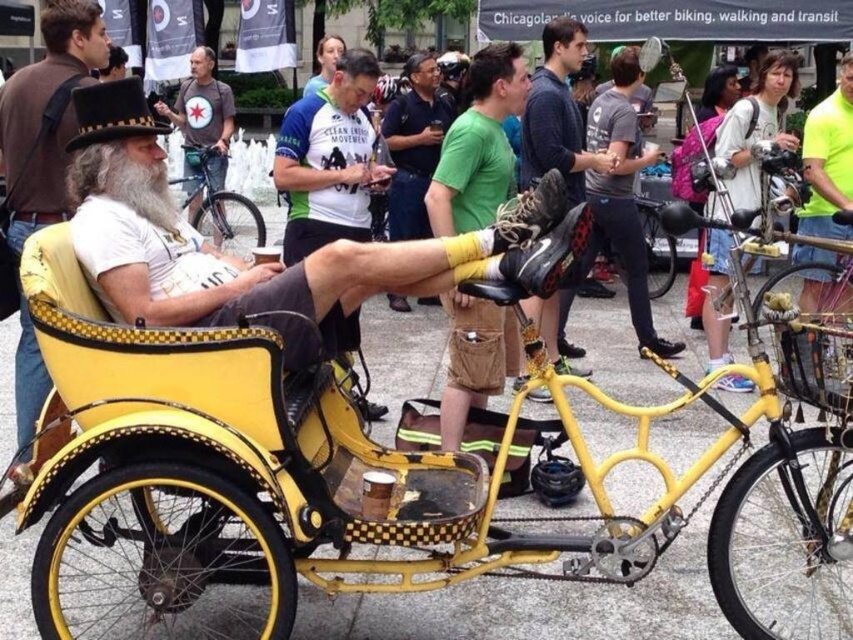
Does white jersey at center have a greater height compared to shiny metallic bicycle at center?

Indeed, white jersey at center has a greater height compared to shiny metallic bicycle at center.

This screenshot has height=640, width=853. Describe the element at coordinates (329, 160) in the screenshot. I see `white jersey at center` at that location.

You are a GUI agent. You are given a task and a screenshot of the screen. Output one action in this format:
    pyautogui.click(x=<x>, y=<y>)
    Task: Click on the white jersey at center
    The height and width of the screenshot is (640, 853).
    Given the screenshot: What is the action you would take?
    click(329, 160)

The image size is (853, 640). What do you see at coordinates (622, 193) in the screenshot?
I see `gray cotton t-shirt at center` at bounding box center [622, 193].

Is gray cotton t-shirt at center taller than matte gray t-shirt at center?

Indeed, gray cotton t-shirt at center has a greater height compared to matte gray t-shirt at center.

The image size is (853, 640). What are the coordinates of `gray cotton t-shirt at center` in the screenshot? It's located at (622, 193).

Find the location of a particular element. gray cotton t-shirt at center is located at coordinates (622, 193).

Does yellow painted wood cart at left come in front of matte black shoe at center?

Yes, yellow painted wood cart at left is closer to the viewer.

Which is behind, point (4, 172) or point (552, 68)?

The point (552, 68) is more distant.

Where is `yellow painted wood cart at left`? The height and width of the screenshot is (640, 853). yellow painted wood cart at left is located at coordinates (44, 113).